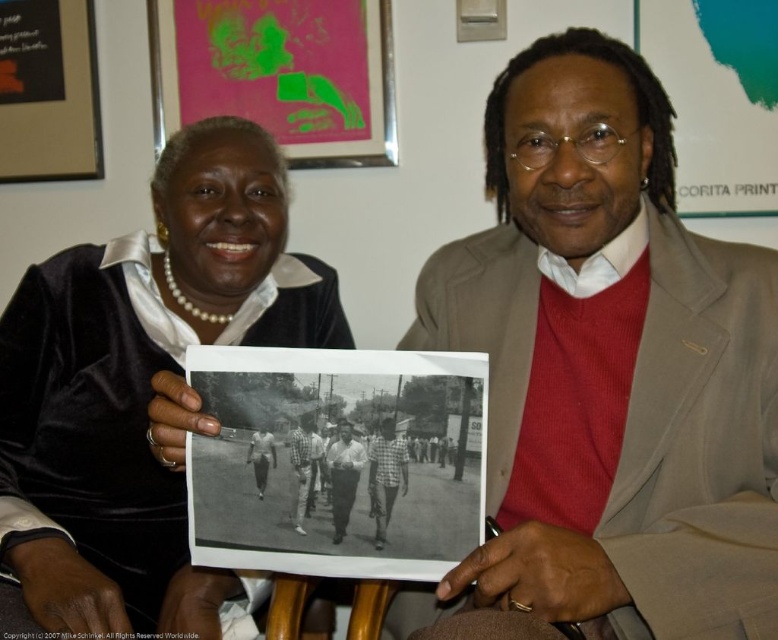
You are a photographer trying to capture a detailed shot of the velvet black dress at center and the plaid shirt at center in the photograph they are holding. Since the dress is taller than the plaid shirt, where should you focus your camera to ensure both are in frame?

Since the velvet black dress at center is taller than the plaid shirt at center, you should focus your camera on the upper part of the photograph to capture the full height of the velvet black dress at center while still including the plaid shirt at center below it.

You are a photographer trying to capture a closeup of the checkered fabric shirt at center and the white cotton shirt at center in the image. Since the shirts are at the same central position, which one would appear larger in the photo?

The checkered fabric shirt at center would appear larger in the photo because its width surpasses that of the white cotton shirt at center.